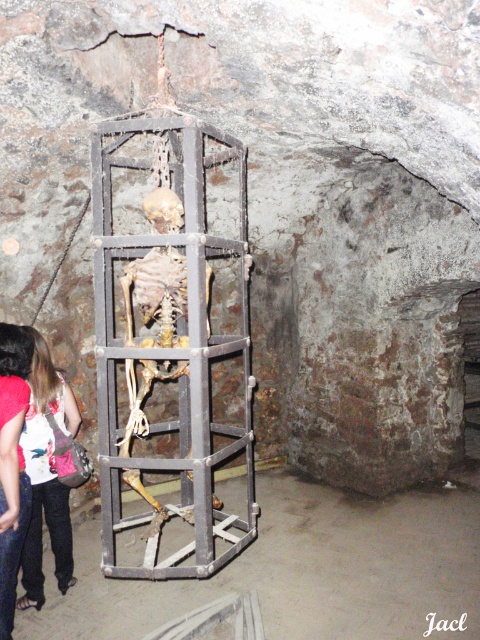
You are an explorer in a dark dungeon. You see a wooden cage at center and a denim jacket at lower left. Which object is closer to the right wall?

The wooden cage at center is positioned on the right side of denim jacket at lower left, so it is closer to the right wall.

You are an explorer in a dark dungeon. You see the rusty metal cage at center. Can you estimate where it is located in the scene?

The rusty metal cage at center is located at the center of the scene, specifically at the 2D coordinates point (168, 332).

You are an explorer holding a 1.5 meter long ladder. You need to reach the wooden cage at center to retrieve an item inside. Can you reach it with your ladder?

The wooden cage at center is 3.32 meters from the camera. Since the ladder is only 1.5 meters long, it is not long enough to reach the cage. You will need a longer ladder or another method to access it.